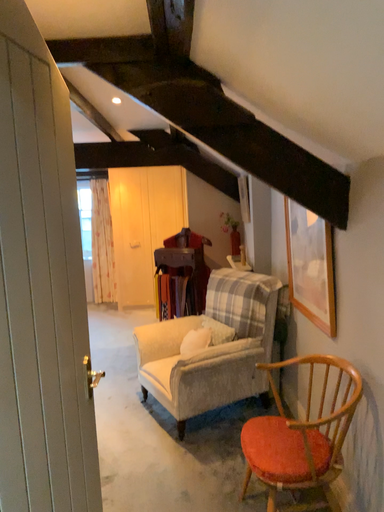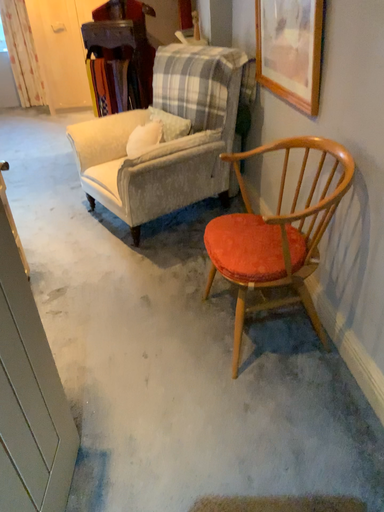
Question: Which way did the camera rotate in the video?

Choices:
 (A) rotated upward
 (B) rotated downward

Answer: (B)